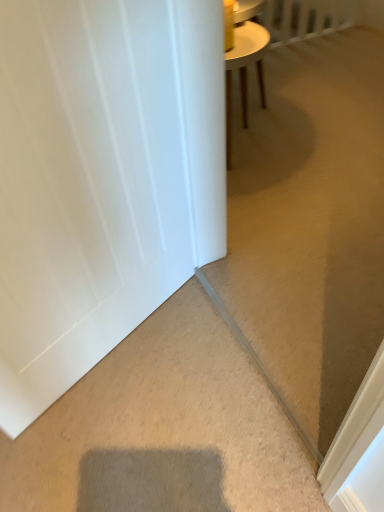
Question: Should I look upward or downward to see white matte door at left?

Choices:
 (A) up
 (B) down

Answer: (A)